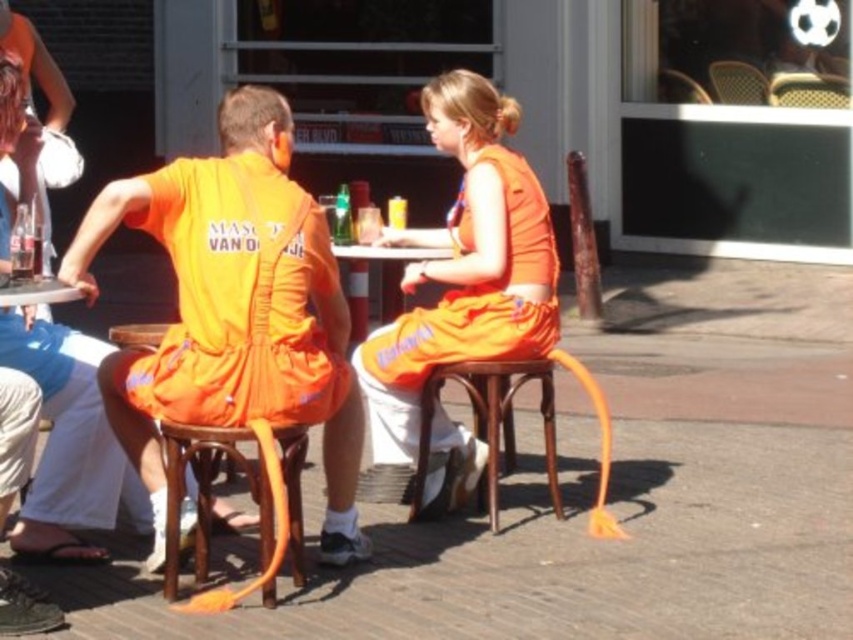
Question: Which object is farther from the camera taking this photo?

Choices:
 (A) orange fabric dress at center
 (B) matte glass bottle at left
 (C) wooden textured chair at upper right
 (D) wooden chair at upper center

Answer: (D)

Question: Which of the following is the farthest from the observer?

Choices:
 (A) (788, 77)
 (B) (689, 86)
 (C) (277, 202)
 (D) (445, 81)

Answer: (B)

Question: Does orange fabric dress at center appear over wooden stool at center?

Choices:
 (A) no
 (B) yes

Answer: (B)

Question: From the image, what is the correct spatial relationship of matte orange dress at left in relation to matte glass bottle at left?

Choices:
 (A) right
 (B) left

Answer: (A)

Question: Which point appears farthest from the camera in this image?

Choices:
 (A) (685, 93)
 (B) (299, 364)
 (C) (747, 92)
 (D) (821, 99)

Answer: (A)

Question: From the image, what is the correct spatial relationship of wooden chair at upper center in relation to translucent plastic cup at center?

Choices:
 (A) left
 (B) right

Answer: (B)